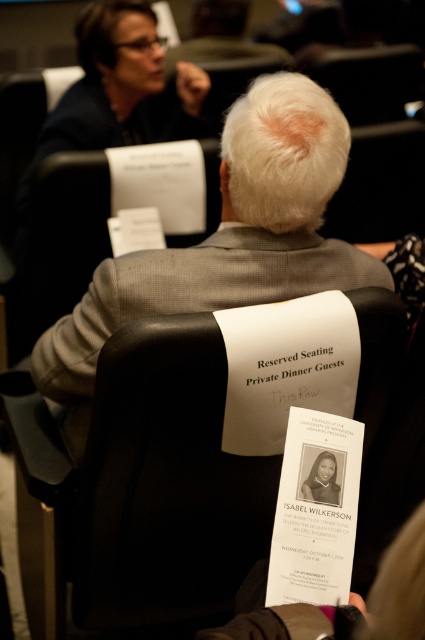
Question: Which object is positioned farthest from the black leather chair at center?

Choices:
 (A) gray woolen suit at center
 (B) black paper brochure at center

Answer: (B)

Question: Does gray woolen suit at center come behind black paper brochure at center?

Choices:
 (A) no
 (B) yes

Answer: (B)

Question: Can you confirm if gray woolen suit at center is wider than black paper brochure at center?

Choices:
 (A) yes
 (B) no

Answer: (A)

Question: Which point appears farthest from the camera in this image?

Choices:
 (A) (193, 264)
 (B) (223, 609)
 (C) (323, 413)

Answer: (B)

Question: In this image, where is black leather chair at center located relative to gray woolen suit at center?

Choices:
 (A) right
 (B) left

Answer: (B)

Question: Which of these objects is positioned farthest from the black leather chair at center?

Choices:
 (A) black paper brochure at center
 (B) gray woolen suit at center

Answer: (A)